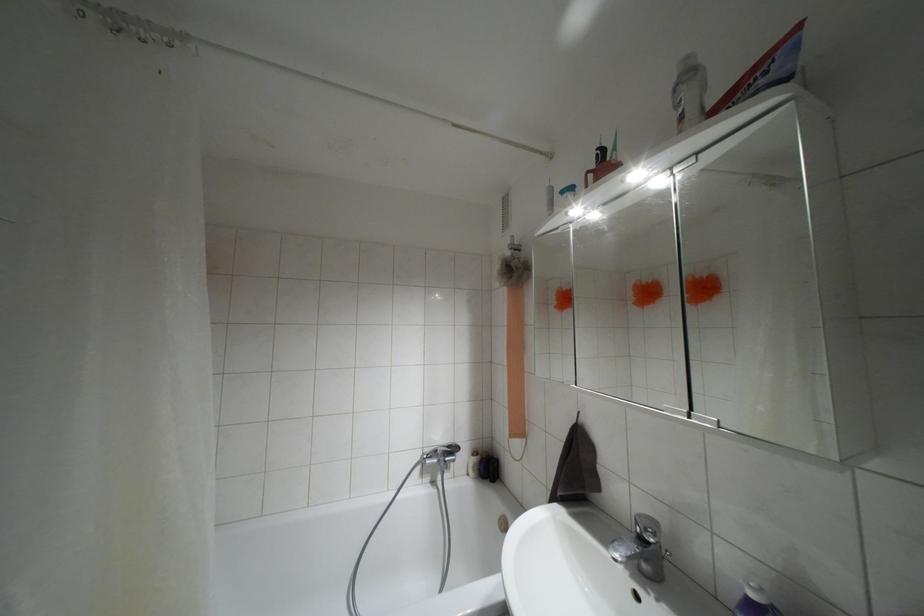
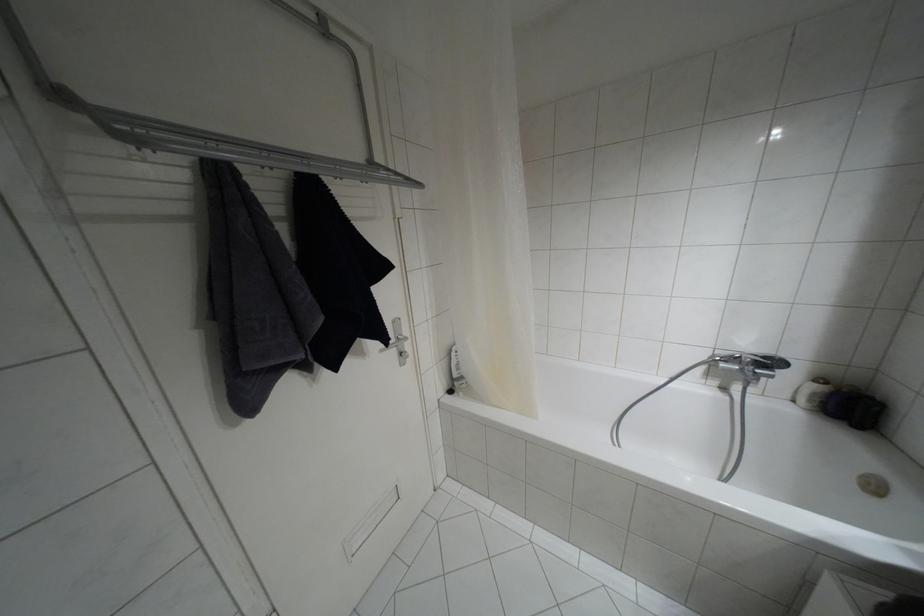
Where in the second image is the point corresponding to pixel 447 446 from the first image?

(763, 357)